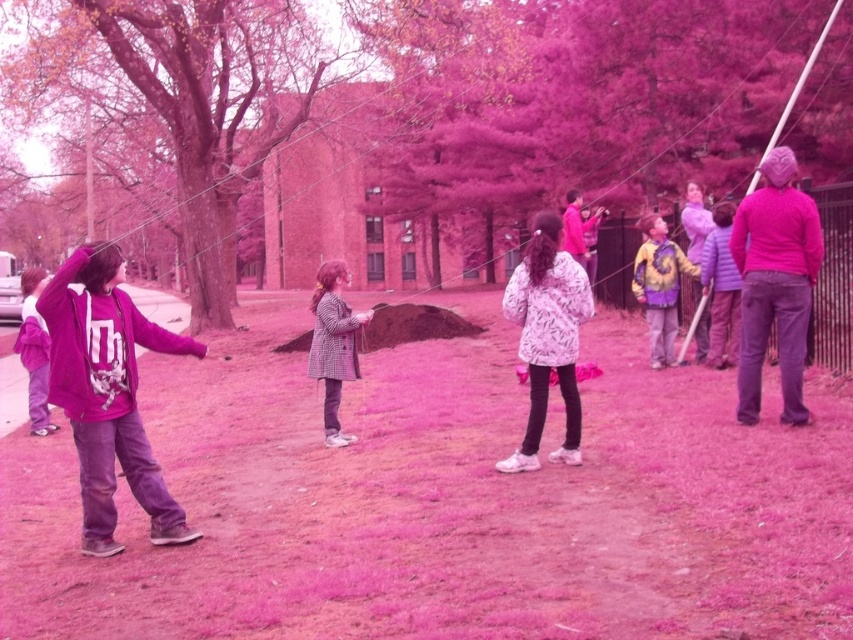
Based on the coordinates provided in the scene description, can you determine the exact position of the brown soil at center?

The brown soil at center is located at the 2D coordinates point (445, 502).

You are a photographer positioned at the edge of the park scene. You want to take a photo that includes both the pink matte tree at upper center and the purple matte hoodie at left. Which object should you adjust your camera focus on first to ensure both are in the frame?

The pink matte tree at upper center is further to the viewer than the purple matte hoodie at left, so you should focus on the pink matte tree at upper center first to ensure both are in the frame.

You are a photographer trying to capture a photo of the pink velvety sweater at right without including the pink matte tree at upper center in the frame. Is this possible based on their positions?

The pink matte tree at upper center is positioned over the pink velvety sweater at right, so it would be difficult to capture the sweater without including the tree in the frame unless you move your camera angle lower or closer to the ground.